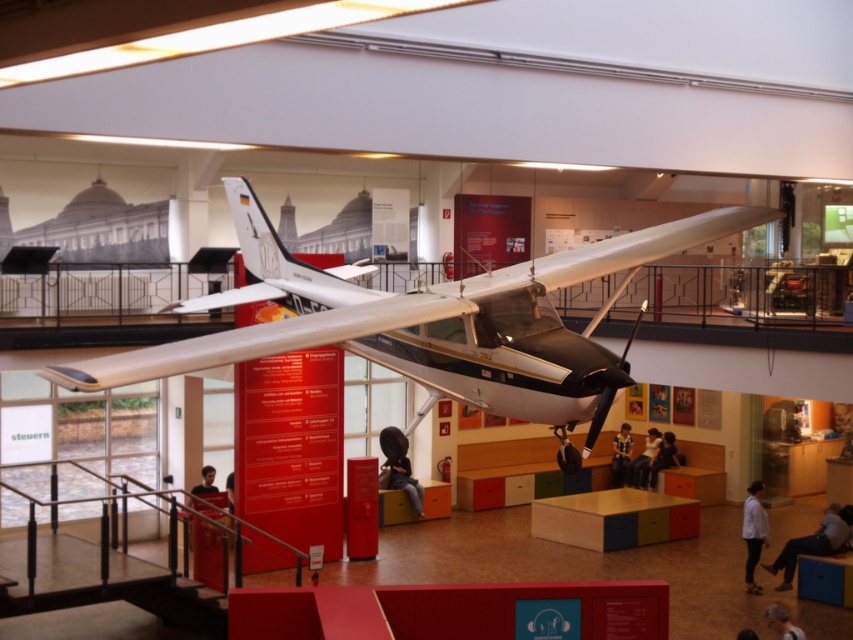
You are standing in the museum and want to take a photo of the metallic silver airplane at center without the striped shirt at center appearing in the frame. Is this possible based on their positions?

The metallic silver airplane at center is closer to the viewer than the striped shirt at center. Therefore, you can position yourself so that the airplane is in the foreground and the shirt is out of the frame by adjusting your angle or distance, making it possible to take a photo without the shirt appearing.

You are a visitor standing in the museum and see the metallic silver airplane at center and the light blue jeans at center. Which object is shorter in height?

The metallic silver airplane at center is not as tall as the light blue jeans at center, so the metallic silver airplane at center is shorter in height.